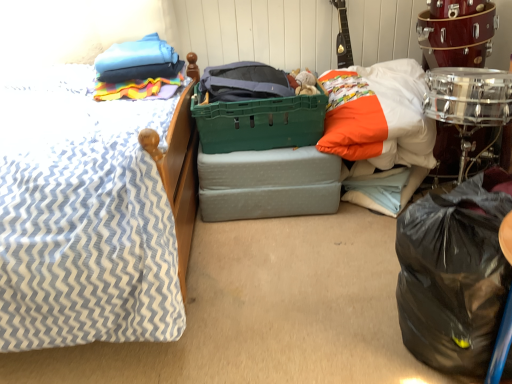
Question: From the image's perspective, relative to white cotton pillow at upper right, marked as the first pillow in a right-to-left arrangement, is green plastic basket at center above or below?

Choices:
 (A) above
 (B) below

Answer: (A)

Question: Would you say green plastic basket at center is inside or outside white cotton pillow at upper right, which appears as the second pillow when viewed from the left?

Choices:
 (A) inside
 (B) outside

Answer: (B)

Question: Which object is the closest to the green plastic storage box at center?

Choices:
 (A) white cotton pillow at upper right, marked as the first pillow in a right-to-left arrangement
 (B) blue fabric pillow at upper left, the 2th pillow when ordered from right to left
 (C) black plastic bag at lower right
 (D) shiny silver drum at right
 (E) green plastic basket at center

Answer: (E)

Question: Considering the real-world distances, which object is farthest from the shiny silver drum at right?

Choices:
 (A) green plastic storage box at center
 (B) blue fabric pillow at upper left, the 2th pillow when ordered from right to left
 (C) white cotton pillow at upper right, which appears as the second pillow when viewed from the left
 (D) black plastic bag at lower right
 (E) green plastic basket at center

Answer: (B)